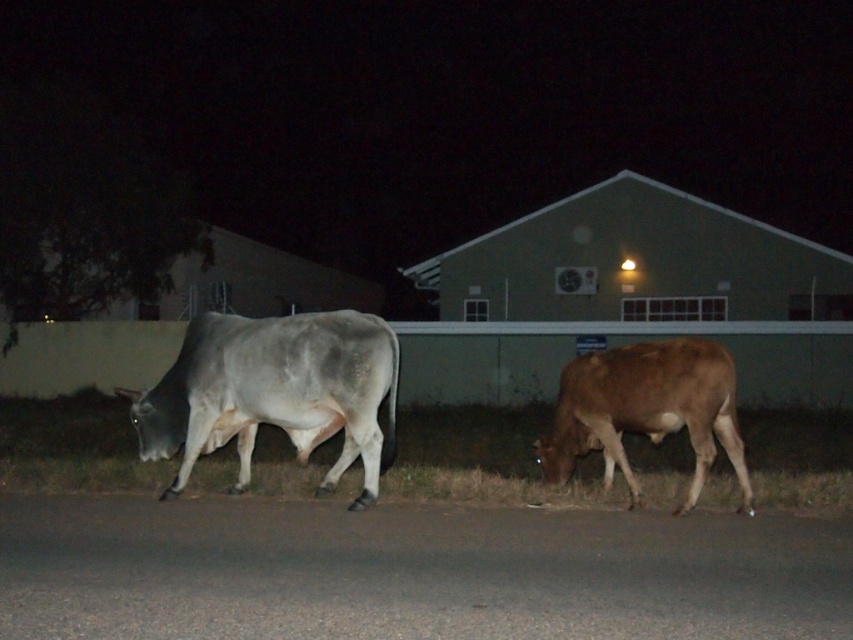
You are a farmer checking on your animals at night. You notice the gray matte cow at center and the brown matte bull at lower right on the road. Which animal is closer to the left side of the road?

The gray matte cow at center is positioned on the left side of the brown matte bull at lower right, so it is closer to the left side of the road.

You are a farmer checking the road for stray animals. You see the gray matte cow at center and the brown matte bull at lower right. Which animal is positioned higher up in the image?

The gray matte cow at center is positioned higher up in the image than the brown matte bull at lower right.

You are a farmer checking the pasture at night. You notice the green grass at lower center and the gray matte cow at center. Which object is shorter?

The green grass at lower center is shorter than the gray matte cow at center.